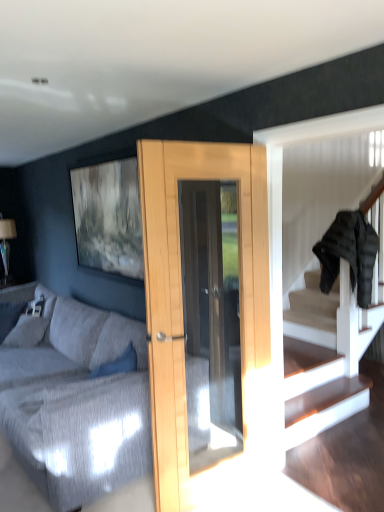
Identify the location of textured gray fabric couch at center. (77, 404).

This screenshot has width=384, height=512. Describe the element at coordinates (77, 404) in the screenshot. I see `textured gray fabric couch at center` at that location.

In order to face black puffer jacket at upper right, should I rotate leftwards or rightwards?

Turn right approximately 19.683 degrees to face it.

The image size is (384, 512). What do you see at coordinates (349, 253) in the screenshot? I see `black puffer jacket at upper right` at bounding box center [349, 253].

Image resolution: width=384 pixels, height=512 pixels. In order to click on black puffer jacket at upper right in this screenshot , I will do `click(349, 253)`.

Find the location of a particular element. The height and width of the screenshot is (512, 384). textured gray fabric couch at center is located at coordinates (77, 404).

Based on the photo, which object is positioned more to the left, black puffer jacket at upper right or textured gray fabric couch at center?

From the viewer's perspective, textured gray fabric couch at center appears more on the left side.

Relative to textured gray fabric couch at center, is black puffer jacket at upper right in front or behind?

Visually, black puffer jacket at upper right is located behind textured gray fabric couch at center.

Does point (363, 232) appear closer or farther from the camera than point (63, 463)?

Point (363, 232) appears to be farther away from the viewer than point (63, 463).

From the image's perspective, between black puffer jacket at upper right and textured gray fabric couch at center, which one is located above?

black puffer jacket at upper right.

From a real-world perspective, who is located lower, black puffer jacket at upper right or textured gray fabric couch at center?

From a 3D spatial view, textured gray fabric couch at center is below.

Can you confirm if black puffer jacket at upper right is wider than textured gray fabric couch at center?

No.

Is black puffer jacket at upper right shorter than textured gray fabric couch at center?

No.

Between black puffer jacket at upper right and textured gray fabric couch at center, which one has smaller size?

black puffer jacket at upper right is smaller.

Could textured gray fabric couch at center be considered to be inside black puffer jacket at upper right?

Definitely not — textured gray fabric couch at center is not inside black puffer jacket at upper right.

Is black puffer jacket at upper right touching textured gray fabric couch at center?

No, black puffer jacket at upper right is not making contact with textured gray fabric couch at center.

Does black puffer jacket at upper right turn towards textured gray fabric couch at center?

No, black puffer jacket at upper right does not turn towards textured gray fabric couch at center.

What's the angular difference between black puffer jacket at upper right and textured gray fabric couch at center's facing directions?

3.2 degrees separate the facing orientations of black puffer jacket at upper right and textured gray fabric couch at center.

Identify the location of clothe above the textured gray fabric couch at center (from a real-world perspective). The width and height of the screenshot is (384, 512). (349, 253).

Is textured gray fabric couch at center at the right side of black puffer jacket at upper right?

No.

Is textured gray fabric couch at center in front of or behind black puffer jacket at upper right in the image?

In the image, textured gray fabric couch at center appears in front of black puffer jacket at upper right.

Is point (76, 481) positioned in front of point (334, 260)?

Yes, point (76, 481) is in front of point (334, 260).

From the image's perspective, between textured gray fabric couch at center and black puffer jacket at upper right, who is located below?

textured gray fabric couch at center.

From a real-world perspective, which is physically above, textured gray fabric couch at center or black puffer jacket at upper right?

black puffer jacket at upper right.

Can you confirm if textured gray fabric couch at center is thinner than black puffer jacket at upper right?

No.

Based on the photo, which of these two, textured gray fabric couch at center or black puffer jacket at upper right, stands taller?

Standing taller between the two is black puffer jacket at upper right.

Looking at this image, considering the sizes of objects textured gray fabric couch at center and black puffer jacket at upper right in the image provided, who is bigger, textured gray fabric couch at center or black puffer jacket at upper right?

textured gray fabric couch at center.

Would you say black puffer jacket at upper right is part of textured gray fabric couch at center's contents?

No, black puffer jacket at upper right is not surrounded by textured gray fabric couch at center.

Is textured gray fabric couch at center not close to black puffer jacket at upper right?

That's right, there is a large distance between textured gray fabric couch at center and black puffer jacket at upper right.

Is textured gray fabric couch at center aimed at black puffer jacket at upper right?

No.

Locate an element on the screen. The height and width of the screenshot is (512, 384). clothe above the textured gray fabric couch at center (from the image's perspective) is located at coordinates (349, 253).

The width and height of the screenshot is (384, 512). In order to click on clothe above the textured gray fabric couch at center (from the image's perspective) in this screenshot , I will do `click(349, 253)`.

Image resolution: width=384 pixels, height=512 pixels. Identify the location of studio couch on the left of black puffer jacket at upper right. (77, 404).